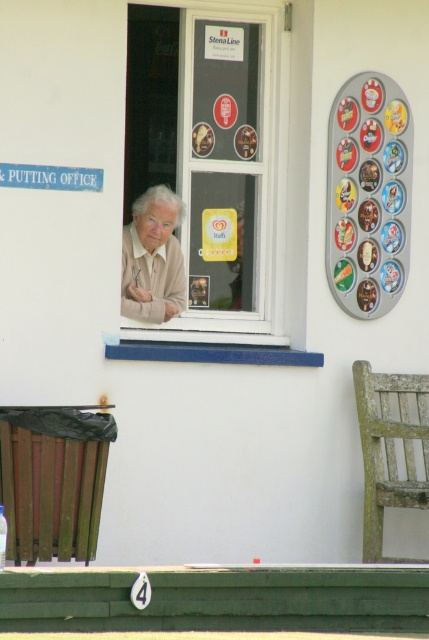
Is white plastic window at center further to the viewer compared to light beige sweater at center?

Yes, it is.

Does white plastic window at center have a lesser height compared to light beige sweater at center?

No, white plastic window at center is not shorter than light beige sweater at center.

Does point (265, 184) lie in front of point (183, 292)?

No, it is not.

Locate an element on the screen. white plastic window at center is located at coordinates (229, 163).